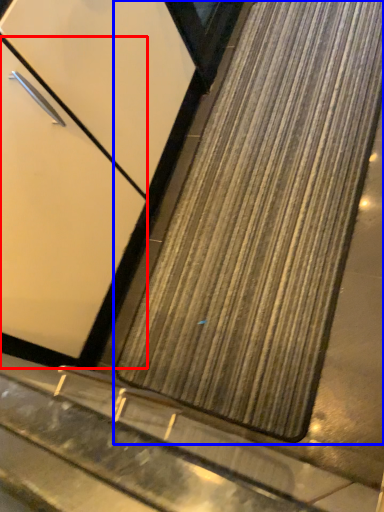
Question: Which object is further to the camera taking this photo, door (highlighted by a red box) or mat (highlighted by a blue box)?

Choices:
 (A) door
 (B) mat

Answer: (B)